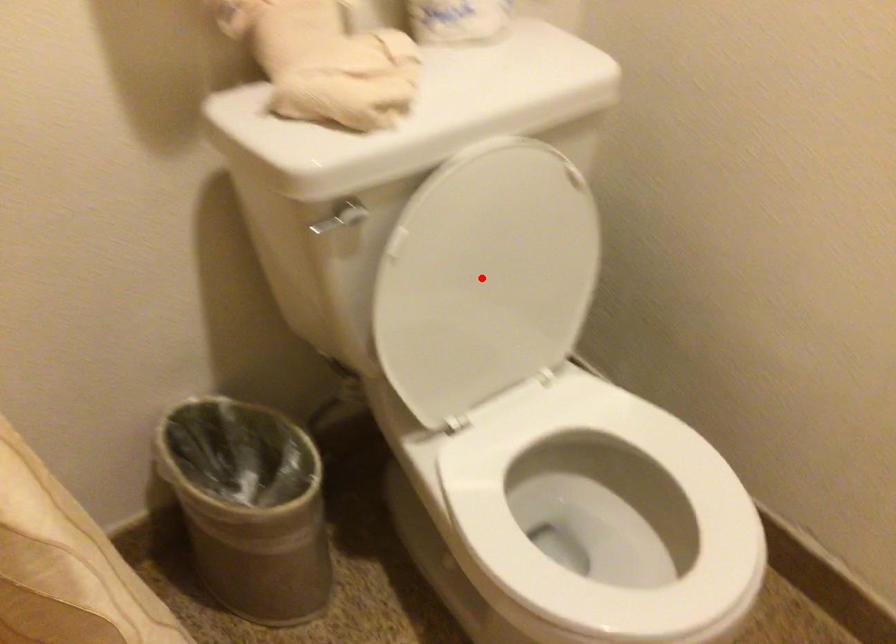
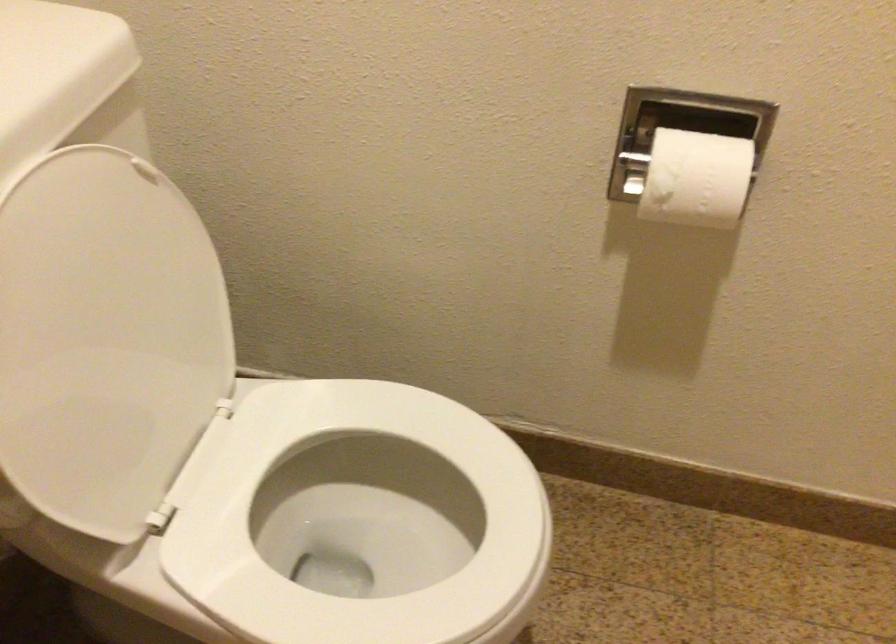
Find the pixel in the second image that matches the highlighted location in the first image.

(105, 339)